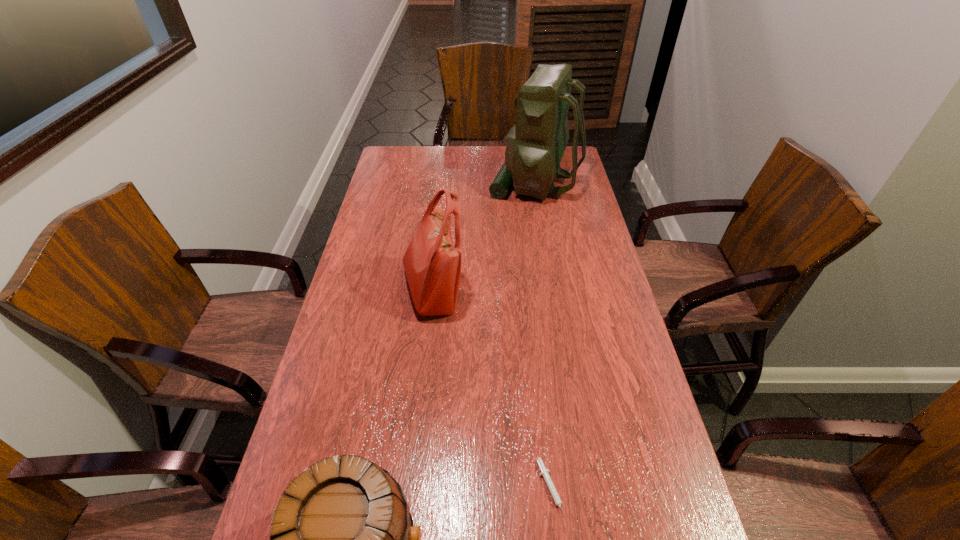
The image size is (960, 540). I want to click on object that is at the far edge, so click(x=535, y=145).

The height and width of the screenshot is (540, 960). In order to click on object at the right edge in this screenshot , I will do `click(535, 145)`.

This screenshot has height=540, width=960. In order to click on object that is at the far right corner in this screenshot , I will do `click(535, 145)`.

The image size is (960, 540). What are the coordinates of `vacant area at the far edge` in the screenshot? It's located at (455, 146).

You are a GUI agent. You are given a task and a screenshot of the screen. Output one action in this format:
    pyautogui.click(x=<x>, y=<y>)
    Task: Click on the vacant region at the left edge
    
    Given the screenshot: What is the action you would take?
    tap(290, 466)

Image resolution: width=960 pixels, height=540 pixels. I want to click on vacant space at the right edge of the desktop, so click(x=613, y=394).

Where is `empty space between the second farthest object and the tallest object`? empty space between the second farthest object and the tallest object is located at coordinates (484, 237).

Identify the location of empty location between the farthest object and the shortest object. Image resolution: width=960 pixels, height=540 pixels. (542, 336).

Find the location of a particular element. This screenshot has width=960, height=540. blank region between the second farthest object and the farthest object is located at coordinates (484, 237).

I want to click on vacant space that is in between the third shortest object and the farthest object, so click(484, 237).